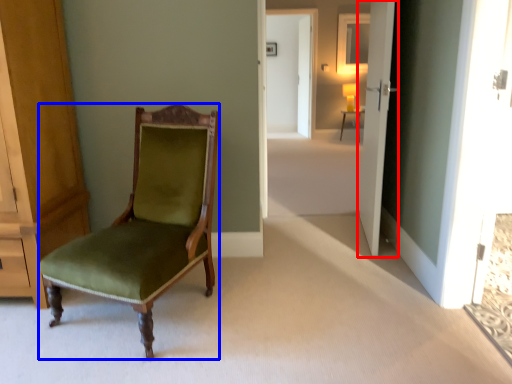
Question: Which of the following is the closest to the observer, door (highlighted by a red box) or chair (highlighted by a blue box)?

Choices:
 (A) door
 (B) chair

Answer: (B)